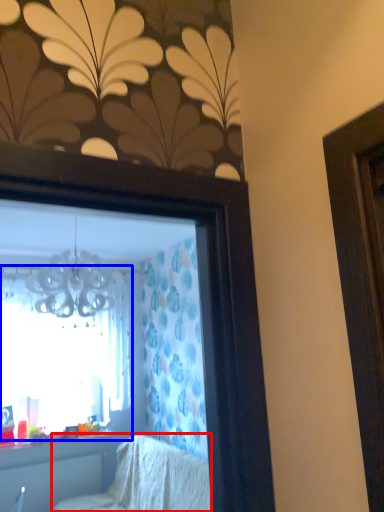
Question: Which point is closer to the camera, furniture (highlighted by a red box) or window (highlighted by a blue box)?

Choices:
 (A) furniture
 (B) window

Answer: (A)